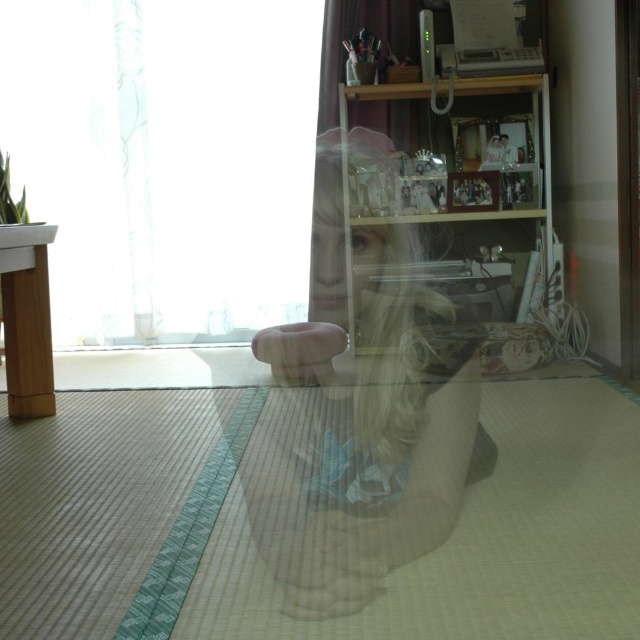
You are standing in the room and want to place a small potted plant on a surface. Which object, the transparent wood table at left or the transparent glass door at right, is a suitable surface for placing the plant?

The transparent wood table at left is a suitable surface for placing the plant because it is a table, which is typically used for placing objects, whereas the transparent glass door at right is a door and not meant for placing items.

You are standing in the room with the traditional Japanese tatami floor. You want to place a 2.5 feet wide potted plant on the transparent wood table at left. Can the potted plant fit on the table?

The transparent wood table at left is 6.16 feet from camera. The question about the potted plant fitting on the table requires knowing the table dimensions, but the provided information only states its distance from the camera. Therefore, it is impossible to determine if the potted plant will fit based on the given details.

You are moving a 9 feet long ladder horizontally through the room. The ladder is currently near the transparent wood table at left. Can you move it to the transparent glass door at right without tilting it vertically?

The distance between the transparent wood table at left and transparent glass door at right is 9.45 feet. Since the ladder is 9 feet long, it can be moved horizontally within this space without tilting as 9 feet is shorter than 9.45 feet.